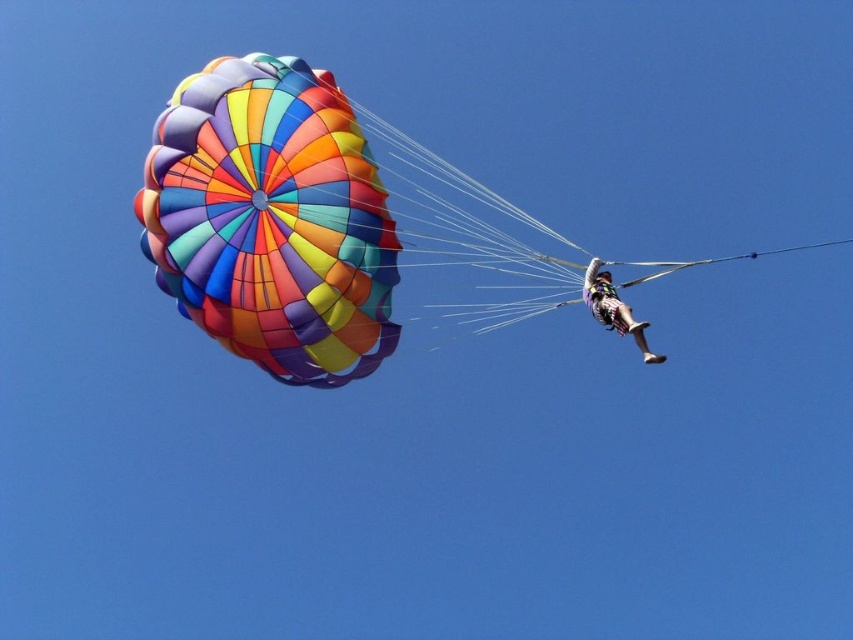
Who is positioned more to the right, multicolored fabric parachute at upper left or multicolored fabric parachute at upper center?

multicolored fabric parachute at upper left is more to the right.

Which is behind, point (341, 131) or point (231, 316)?

Point (341, 131)

Image resolution: width=853 pixels, height=640 pixels. What do you see at coordinates (337, 227) in the screenshot?
I see `multicolored fabric parachute at upper left` at bounding box center [337, 227].

The height and width of the screenshot is (640, 853). Find the location of `multicolored fabric parachute at upper left`. multicolored fabric parachute at upper left is located at coordinates [337, 227].

Can you confirm if multicolored fabric parachute at upper left is taller than multicolored fabric parachute at upper right?

Yes.

Does multicolored fabric parachute at upper left appear under multicolored fabric parachute at upper right?

Incorrect, multicolored fabric parachute at upper left is not positioned below multicolored fabric parachute at upper right.

Describe the element at coordinates (337, 227) in the screenshot. I see `multicolored fabric parachute at upper left` at that location.

Identify the location of multicolored fabric parachute at upper left. The image size is (853, 640). (337, 227).

Is multicolored fabric parachute at upper center shorter than multicolored fabric parachute at upper right?

No, multicolored fabric parachute at upper center is not shorter than multicolored fabric parachute at upper right.

Is multicolored fabric parachute at upper center to the left of multicolored fabric parachute at upper right from the viewer's perspective?

Indeed, multicolored fabric parachute at upper center is positioned on the left side of multicolored fabric parachute at upper right.

Is point (190, 228) less distant than point (595, 317)?

No.

Locate an element on the screen. multicolored fabric parachute at upper center is located at coordinates (271, 220).